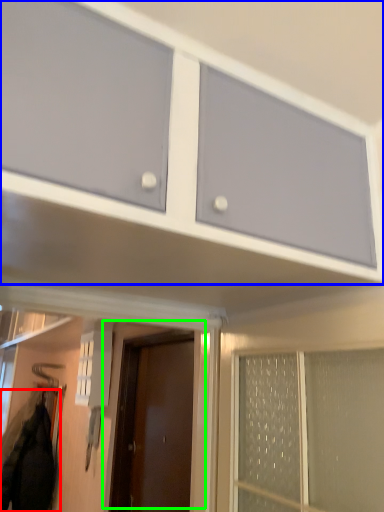
Question: Which is farther away from jacket (highlighted by a red box)? cabinetry (highlighted by a blue box) or door (highlighted by a green box)?

Choices:
 (A) cabinetry
 (B) door

Answer: (A)